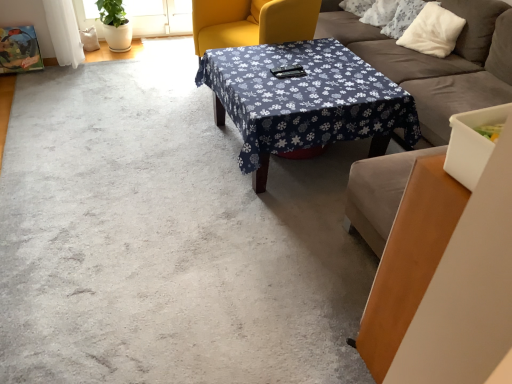
Question: Is soft gray fabric couch at center taller or shorter than matte yellow swivel chair at center?

Choices:
 (A) short
 (B) tall

Answer: (B)

Question: Relative to matte yellow swivel chair at center, is soft gray fabric couch at center in front or behind?

Choices:
 (A) behind
 (B) front

Answer: (B)

Question: Which object is positioned farthest from the white fluffy pillow at upper right?

Choices:
 (A) soft gray fabric couch at center
 (B) blue fabric-covered table at center
 (C) matte yellow swivel chair at center

Answer: (B)

Question: Considering the real-world distances, which object is closest to the blue fabric-covered table at center?

Choices:
 (A) white fluffy pillow at upper right
 (B) matte yellow swivel chair at center
 (C) soft gray fabric couch at center

Answer: (C)